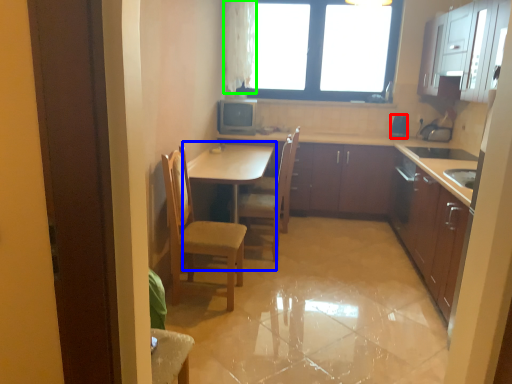
Question: Considering the real-world distances, which object is closest to appliance (highlighted by a red box)? table (highlighted by a blue box) or curtain (highlighted by a green box).

Choices:
 (A) table
 (B) curtain

Answer: (B)